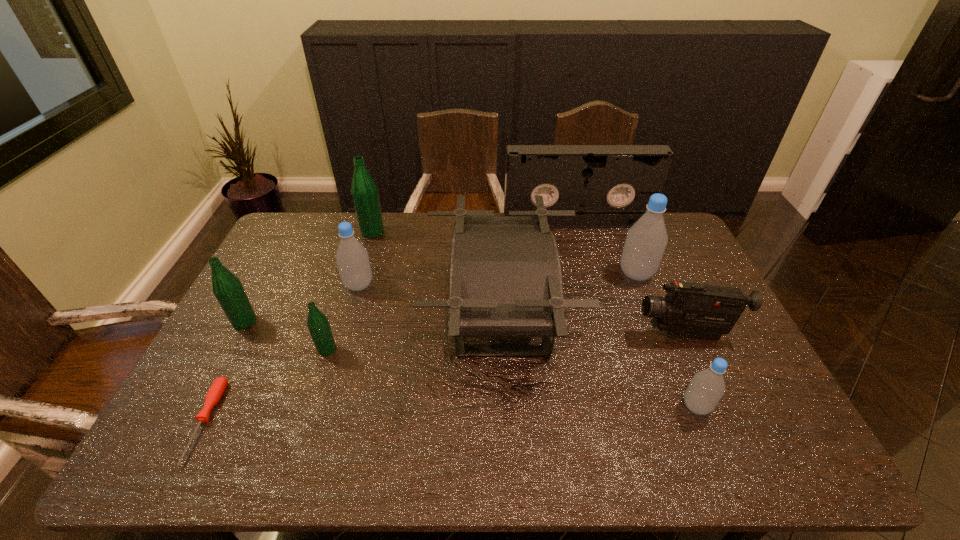
This screenshot has width=960, height=540. In the image, there is a desktop. In order to click on vacant area at the right edge in this screenshot , I will do `click(662, 265)`.

The width and height of the screenshot is (960, 540). I want to click on free space at the far left corner of the desktop, so click(294, 222).

Find the location of `vacant region at the far right corner`. vacant region at the far right corner is located at coordinates (672, 222).

This screenshot has width=960, height=540. What are the coordinates of `empty space that is in between the screwdriver and the smallest gray bottle` in the screenshot? It's located at (450, 414).

Where is `free point between the videotape and the screwdriver`? The image size is (960, 540). free point between the videotape and the screwdriver is located at coordinates (391, 322).

Find the location of `free space between the shortest object and the nearest green bottle`. free space between the shortest object and the nearest green bottle is located at coordinates (266, 386).

I want to click on empty space between the screwdriver and the leftmost bottle, so click(x=225, y=372).

Where is `vacant point located between the smallest gray bottle and the biggest gray bottle`? vacant point located between the smallest gray bottle and the biggest gray bottle is located at coordinates (666, 340).

Locate an element on the screen. The image size is (960, 540). empty location between the leftmost bottle and the farthest green bottle is located at coordinates click(308, 277).

At what (x,y) coordinates should I click in order to perform the action: click on empty space that is in between the screwdriver and the biggest gray bottle. Please return your answer as a coordinate pair (x, y). Looking at the image, I should click on (420, 348).